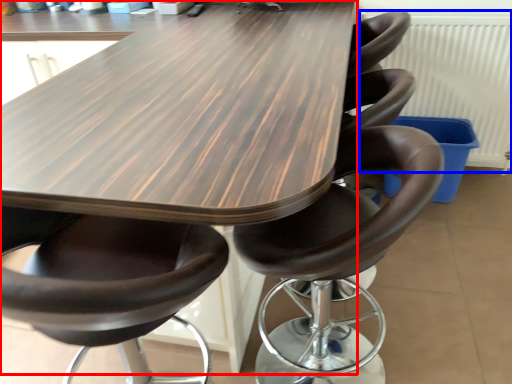
Question: Among these objects, which one is nearest to the camera, table (highlighted by a red box) or radiator (highlighted by a blue box)?

Choices:
 (A) table
 (B) radiator

Answer: (A)